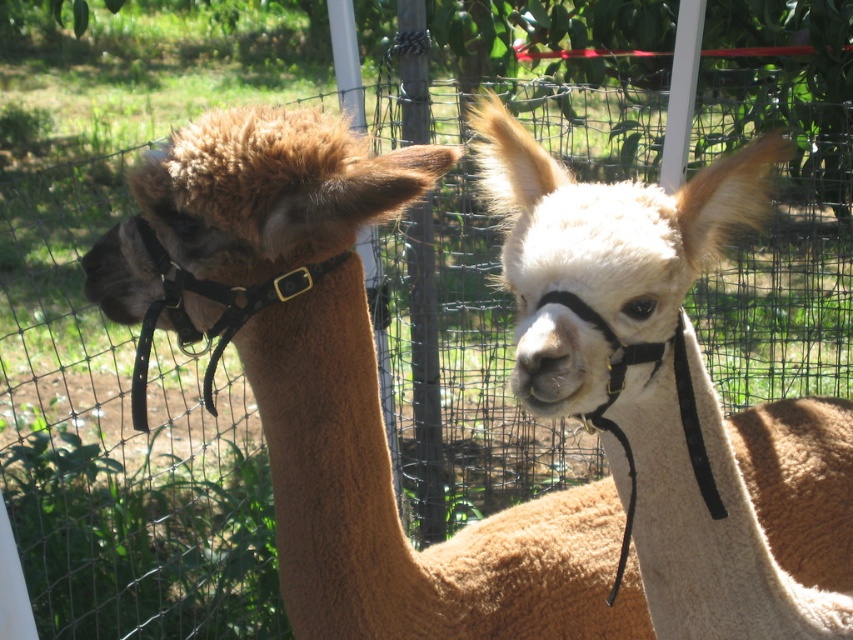
Which is more to the right, white woolen alpaca at center or white woolen nose at center?

Positioned to the right is white woolen alpaca at center.

Who is more forward, (x=479, y=154) or (x=525, y=352)?

Point (x=525, y=352) is in front.

In order to click on white woolen alpaca at center in this screenshot , I will do `click(648, 369)`.